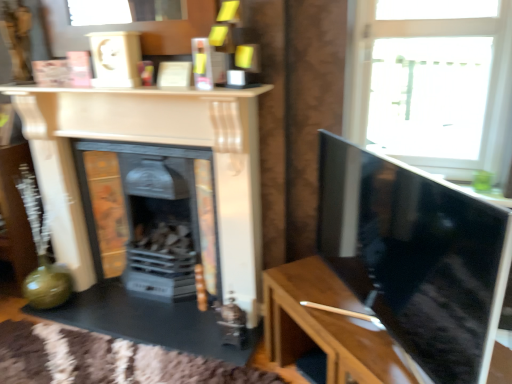
You are a GUI agent. You are given a task and a screenshot of the screen. Output one action in this format:
    pyautogui.click(x=<x>, y=<y>)
    Task: Click on the vacant space underneath matte cream fireplace at center, which ranks as the 1th fireplace in front-to-back order (from a real-world perspective)
    
    Given the screenshot: What is the action you would take?
    pyautogui.click(x=174, y=313)